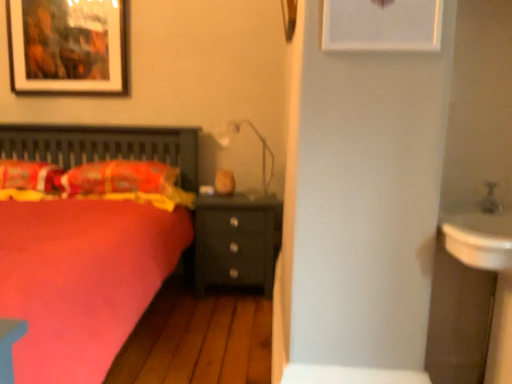
The width and height of the screenshot is (512, 384). What do you see at coordinates (118, 177) in the screenshot? I see `fluffy orange pillow at left, which is the 1th pillow in right-to-left order` at bounding box center [118, 177].

Locate an element on the screen. The image size is (512, 384). matte black nightstand at center is located at coordinates (236, 241).

The width and height of the screenshot is (512, 384). Describe the element at coordinates (258, 138) in the screenshot. I see `matte white lamp at center` at that location.

In order to face fluffy orange pillow at left, which is the second pillow in right-to-left order, should I rotate leftwards or rightwards?

Rotate left and turn 28.994 degrees.

Measure the distance between point (13,180) and camera.

Point (13,180) and camera are 8.31 feet apart from each other.

What do you see at coordinates (382, 25) in the screenshot? I see `white matte picture frame at upper center, which is the 1th picture frame in right-to-left order` at bounding box center [382, 25].

Find the location of a particular element. The width and height of the screenshot is (512, 384). fluffy orange pillow at left, which is the 1th pillow in right-to-left order is located at coordinates (118, 177).

Considering the relative sizes of matte black nightstand at center and matte black picture frame at upper left, which is counted as the second picture frame, starting from the right, in the image provided, is matte black nightstand at center thinner than matte black picture frame at upper left, which is counted as the second picture frame, starting from the right,?

In fact, matte black nightstand at center might be wider than matte black picture frame at upper left, which is counted as the second picture frame, starting from the right.

Which object is closer to the camera, matte black nightstand at center or matte black picture frame at upper left, the 1th picture frame from the back?

matte black nightstand at center is closer to the camera.

Considering the relative positions of matte black nightstand at center and matte black picture frame at upper left, the 1th picture frame from the back, in the image provided, is matte black nightstand at center to the left of matte black picture frame at upper left, the 1th picture frame from the back, from the viewer's perspective?

No, matte black nightstand at center is not to the left of matte black picture frame at upper left, the 1th picture frame from the back.

Based on their sizes in the image, would you say matte black nightstand at center is bigger or smaller than matte black picture frame at upper left, which appears as the second picture frame when viewed from the front?

Clearly, matte black nightstand at center is larger in size than matte black picture frame at upper left, which appears as the second picture frame when viewed from the front.

Which point is more distant from viewer, (82, 175) or (506, 222)?

The point (82, 175) is behind.

Is fluffy orange pillow at left, the 2th pillow in the left-to-right sequence, taller or shorter than white glossy sink at right?

In the image, fluffy orange pillow at left, the 2th pillow in the left-to-right sequence, appears to be taller than white glossy sink at right.

Is fluffy orange pillow at left, the 2th pillow in the left-to-right sequence, looking in the opposite direction of white glossy sink at right?

No, fluffy orange pillow at left, the 2th pillow in the left-to-right sequence,'s orientation is not away from white glossy sink at right.

What's the angular difference between fluffy orange pillow at left, the 2th pillow in the left-to-right sequence, and white glossy sink at right's facing directions?

There is a 0.0219-degree angle between the facing directions of fluffy orange pillow at left, the 2th pillow in the left-to-right sequence, and white glossy sink at right.

From the image's perspective, is fluffy orange pillow at left, which is counted as the first pillow, starting from the left, beneath fluffy orange pillow at left, the 2th pillow in the left-to-right sequence?

Incorrect, from the image's perspective, fluffy orange pillow at left, which is counted as the first pillow, starting from the left, is higher than fluffy orange pillow at left, the 2th pillow in the left-to-right sequence.

Is fluffy orange pillow at left, which is counted as the first pillow, starting from the left, smaller than fluffy orange pillow at left, which is the 1th pillow in right-to-left order?

Indeed, fluffy orange pillow at left, which is counted as the first pillow, starting from the left, has a smaller size compared to fluffy orange pillow at left, which is the 1th pillow in right-to-left order.

Is there a large distance between fluffy orange pillow at left, which is counted as the first pillow, starting from the left, and fluffy orange pillow at left, which is the 1th pillow in right-to-left order?

Actually, fluffy orange pillow at left, which is counted as the first pillow, starting from the left, and fluffy orange pillow at left, which is the 1th pillow in right-to-left order, are a little close together.

Is fluffy orange pillow at left, which is the second pillow in right-to-left order, looking in the opposite direction of fluffy orange pillow at left, the 2th pillow in the left-to-right sequence?

fluffy orange pillow at left, which is the second pillow in right-to-left order, does not have its back to fluffy orange pillow at left, the 2th pillow in the left-to-right sequence.

How distant is matte black picture frame at upper left, which appears as the second picture frame when viewed from the front, from fluffy orange pillow at left, the 2th pillow in the left-to-right sequence?

The distance of matte black picture frame at upper left, which appears as the second picture frame when viewed from the front, from fluffy orange pillow at left, the 2th pillow in the left-to-right sequence, is 32.75 inches.

Where is `pillow that is the 1st object directly below the matte black picture frame at upper left, acting as the 1th picture frame starting from the left (from a real-world perspective)`? Image resolution: width=512 pixels, height=384 pixels. pillow that is the 1st object directly below the matte black picture frame at upper left, acting as the 1th picture frame starting from the left (from a real-world perspective) is located at coordinates (118, 177).

Is matte black picture frame at upper left, which is counted as the second picture frame, starting from the right, turned away from fluffy orange pillow at left, the 2th pillow in the left-to-right sequence?

No, fluffy orange pillow at left, the 2th pillow in the left-to-right sequence, is not at the back of matte black picture frame at upper left, which is counted as the second picture frame, starting from the right.

From a real-world perspective, who is located lower, matte black picture frame at upper left, acting as the 1th picture frame starting from the left, or fluffy orange pillow at left, the 2th pillow in the left-to-right sequence?

In real-world perspective, fluffy orange pillow at left, the 2th pillow in the left-to-right sequence, is lower.

Consider the image. Is fluffy orange pillow at left, which is the second pillow in right-to-left order, taller or shorter than matte black nightstand at center?

In the image, fluffy orange pillow at left, which is the second pillow in right-to-left order, appears to be shorter than matte black nightstand at center.

Which is in front, point (49, 187) or point (208, 217)?

The point (49, 187) is in front.

From the image's perspective, which is above, fluffy orange pillow at left, which is counted as the first pillow, starting from the left, or matte black nightstand at center?

From the image's view, fluffy orange pillow at left, which is counted as the first pillow, starting from the left, is above.

Between fluffy orange pillow at left, which is counted as the first pillow, starting from the left, and matte black nightstand at center, which one is positioned in front?

Positioned in front is fluffy orange pillow at left, which is counted as the first pillow, starting from the left.

From a real-world perspective, count 1st picture frames upward from the matte white lamp at center and point to it. Please provide its 2D coordinates.

[(382, 25)]

From the image's perspective, is white matte picture frame at upper center, placed as the first picture frame when sorted from front to back, above matte white lamp at center?

Yes, from the image's perspective, white matte picture frame at upper center, placed as the first picture frame when sorted from front to back, is over matte white lamp at center.

Considering the sizes of objects white matte picture frame at upper center, which is the 1th picture frame in right-to-left order, and matte white lamp at center in the image provided, who is thinner, white matte picture frame at upper center, which is the 1th picture frame in right-to-left order, or matte white lamp at center?

white matte picture frame at upper center, which is the 1th picture frame in right-to-left order, is thinner.

Would you say matte white lamp at center is a long distance from fluffy orange pillow at left, which is the second pillow in right-to-left order?

Yes, matte white lamp at center and fluffy orange pillow at left, which is the second pillow in right-to-left order, are located far from each other.

Which object is further away from the camera, matte white lamp at center or fluffy orange pillow at left, which is counted as the first pillow, starting from the left?

matte white lamp at center is more distant.

From a real-world perspective, which object stands above the other?

matte white lamp at center is physically above.

In terms of height, does matte white lamp at center look taller or shorter compared to fluffy orange pillow at left, which is the second pillow in right-to-left order?

Considering their sizes, matte white lamp at center has more height than fluffy orange pillow at left, which is the second pillow in right-to-left order.

In the image, there is a matte black picture frame at upper left, acting as the 1th picture frame starting from the left. Identify the location of nightstand below it (from the image's perspective). This screenshot has width=512, height=384. (236, 241).

This screenshot has height=384, width=512. What are the coordinates of `sink on the right of fluffy orange pillow at left, which is the 1th pillow in right-to-left order` in the screenshot? It's located at (479, 232).

Based on their spatial positions, is matte black nightstand at center or matte black picture frame at upper left, which is counted as the second picture frame, starting from the right, further from fluffy orange pillow at left, which is counted as the first pillow, starting from the left?

matte black nightstand at center is further to fluffy orange pillow at left, which is counted as the first pillow, starting from the left.

Based on their spatial positions, is fluffy orange pillow at left, which is counted as the first pillow, starting from the left, or matte black nightstand at center closer to fluffy orange pillow at left, which is the 1th pillow in right-to-left order?

The object closer to fluffy orange pillow at left, which is the 1th pillow in right-to-left order, is fluffy orange pillow at left, which is counted as the first pillow, starting from the left.

Based on their spatial positions, is matte white lamp at center or matte black nightstand at center further from fluffy orange pillow at left, which is the second pillow in right-to-left order?

matte white lamp at center is further to fluffy orange pillow at left, which is the second pillow in right-to-left order.

From the image, which object appears to be nearer to white matte picture frame at upper center, placed as the first picture frame when sorted from front to back, white glossy sink at right or matte white lamp at center?

white glossy sink at right.

When comparing their distances from matte white lamp at center, does matte black nightstand at center or white glossy sink at right seem closer?

matte black nightstand at center is positioned closer to the anchor matte white lamp at center.

Looking at the image, which one is located closer to matte black nightstand at center, white glossy sink at right or matte white lamp at center?

matte white lamp at center is positioned closer to the anchor matte black nightstand at center.

Looking at the image, which one is located closer to fluffy orange pillow at left, which is the 1th pillow in right-to-left order, fluffy orange pillow at left, which is the second pillow in right-to-left order, or white matte picture frame at upper center, which is the 2th picture frame from left to right?

fluffy orange pillow at left, which is the second pillow in right-to-left order, is closer to fluffy orange pillow at left, which is the 1th pillow in right-to-left order.

Estimate the real-world distances between objects in this image. Which object is further from fluffy orange pillow at left, which is the second pillow in right-to-left order, matte black nightstand at center or white glossy sink at right?

white glossy sink at right is further to fluffy orange pillow at left, which is the second pillow in right-to-left order.

This screenshot has width=512, height=384. I want to click on light fixture positioned between white glossy sink at right and matte black nightstand at center from near to far, so [x=258, y=138].

I want to click on picture frame between white glossy sink at right and matte black nightstand at center along the z-axis, so click(x=382, y=25).

The height and width of the screenshot is (384, 512). I want to click on picture frame between fluffy orange pillow at left, which is the 1th pillow in right-to-left order, and white glossy sink at right from left to right, so click(382, 25).

The width and height of the screenshot is (512, 384). I want to click on pillow situated between fluffy orange pillow at left, which is counted as the first pillow, starting from the left, and matte black nightstand at center from left to right, so click(118, 177).